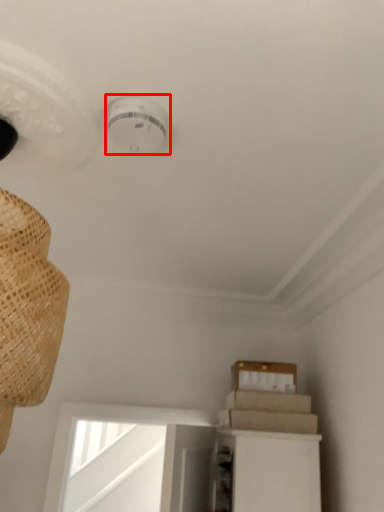
Question: From the image's perspective, where is lamp (annotated by the red box) located relative to cardboard box?

Choices:
 (A) above
 (B) below

Answer: (A)